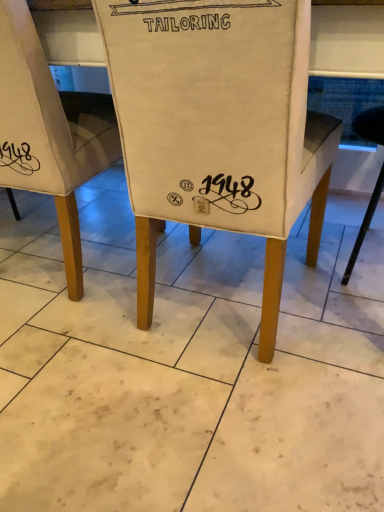
Question: Considering the relative positions of white fabric chair at center, which is the 2th chair in right-to-left order, and canvas chair at center, which is the second chair from left to right, in the image provided, is white fabric chair at center, which is the 2th chair in right-to-left order, in front of canvas chair at center, which is the second chair from left to right,?

Choices:
 (A) yes
 (B) no

Answer: (B)

Question: Would you say white fabric chair at center, which is the 2th chair in right-to-left order, is outside canvas chair at center, marked as the first chair in a right-to-left arrangement?

Choices:
 (A) no
 (B) yes

Answer: (B)

Question: Is white fabric chair at center, the 1th chair viewed from the left, at the right side of canvas chair at center, which is the second chair from left to right?

Choices:
 (A) no
 (B) yes

Answer: (A)

Question: Is canvas chair at center, marked as the first chair in a right-to-left arrangement, a part of white fabric chair at center, the 1th chair viewed from the left?

Choices:
 (A) no
 (B) yes

Answer: (A)

Question: Is white fabric chair at center, the 1th chair viewed from the left, not near canvas chair at center, which is the second chair from left to right?

Choices:
 (A) no
 (B) yes

Answer: (A)

Question: Can you confirm if white fabric chair at center, the 1th chair viewed from the left, is positioned to the left of canvas chair at center, which is the second chair from left to right?

Choices:
 (A) yes
 (B) no

Answer: (A)

Question: Is canvas chair at center, marked as the first chair in a right-to-left arrangement, located outside white fabric chair at center, the 1th chair viewed from the left?

Choices:
 (A) no
 (B) yes

Answer: (B)

Question: Is canvas chair at center, which is the second chair from left to right, smaller than white fabric chair at center, which is the 2th chair in right-to-left order?

Choices:
 (A) yes
 (B) no

Answer: (B)

Question: Is canvas chair at center, marked as the first chair in a right-to-left arrangement, closer to the viewer compared to white fabric chair at center, the 1th chair viewed from the left?

Choices:
 (A) yes
 (B) no

Answer: (A)

Question: Does canvas chair at center, marked as the first chair in a right-to-left arrangement, appear on the left side of white fabric chair at center, which is the 2th chair in right-to-left order?

Choices:
 (A) no
 (B) yes

Answer: (A)

Question: From a real-world perspective, is canvas chair at center, marked as the first chair in a right-to-left arrangement, positioned over white fabric chair at center, the 1th chair viewed from the left, based on gravity?

Choices:
 (A) no
 (B) yes

Answer: (A)

Question: From a real-world perspective, does canvas chair at center, marked as the first chair in a right-to-left arrangement, sit lower than white fabric chair at center, which is the 2th chair in right-to-left order?

Choices:
 (A) yes
 (B) no

Answer: (A)

Question: Considering the positions of canvas chair at center, marked as the first chair in a right-to-left arrangement, and white fabric chair at center, the 1th chair viewed from the left, in the image, is canvas chair at center, marked as the first chair in a right-to-left arrangement, taller or shorter than white fabric chair at center, the 1th chair viewed from the left,?

Choices:
 (A) short
 (B) tall

Answer: (A)